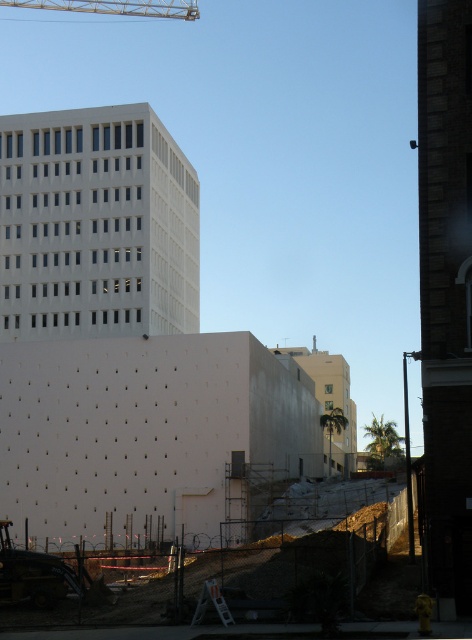
Which is more to the right, white smooth building at upper left or yellow metallic crane at upper left?

Positioned to the right is white smooth building at upper left.

Can you confirm if white smooth building at upper left is smaller than yellow metallic crane at upper left?

Yes, white smooth building at upper left is smaller than yellow metallic crane at upper left.

Locate an element on the screen. The width and height of the screenshot is (472, 640). white smooth building at upper left is located at coordinates coord(97,225).

Find the location of `white smooth building at upper left`. white smooth building at upper left is located at coordinates (97, 225).